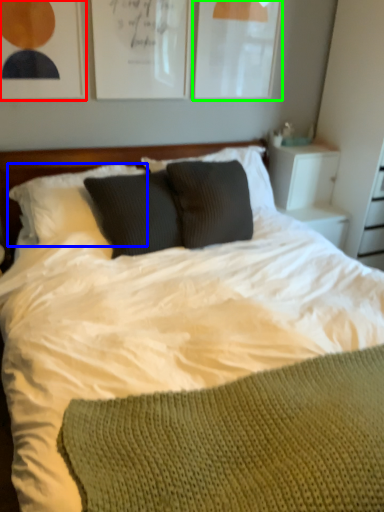
Question: Estimate the real-world distances between objects in this image. Which object is closer to picture frame (highlighted by a red box), pillow (highlighted by a blue box) or picture frame (highlighted by a green box)?

Choices:
 (A) pillow
 (B) picture frame

Answer: (A)